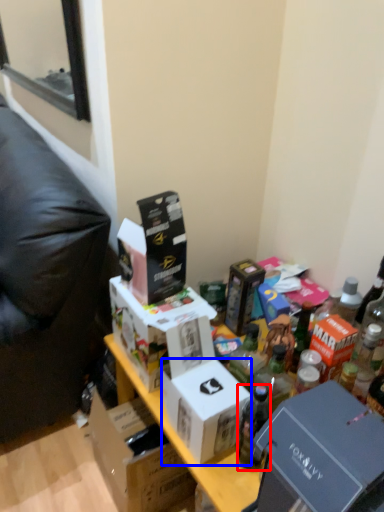
Question: Which of the following is the farthest to the observer, bottle (highlighted by a red box) or box (highlighted by a blue box)?

Choices:
 (A) bottle
 (B) box

Answer: (A)